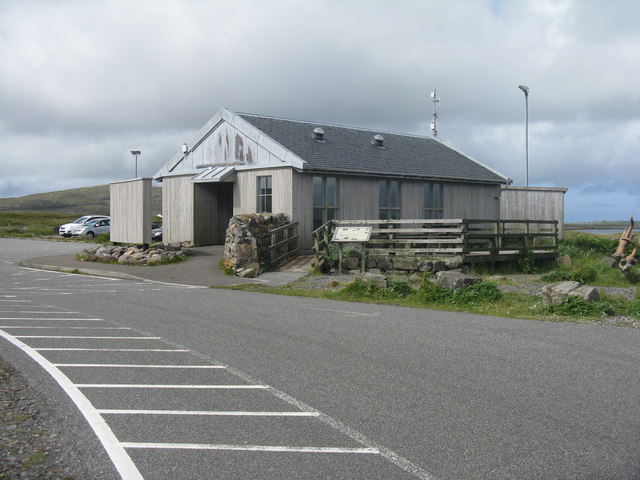
I want to click on vents, so click(x=320, y=150).